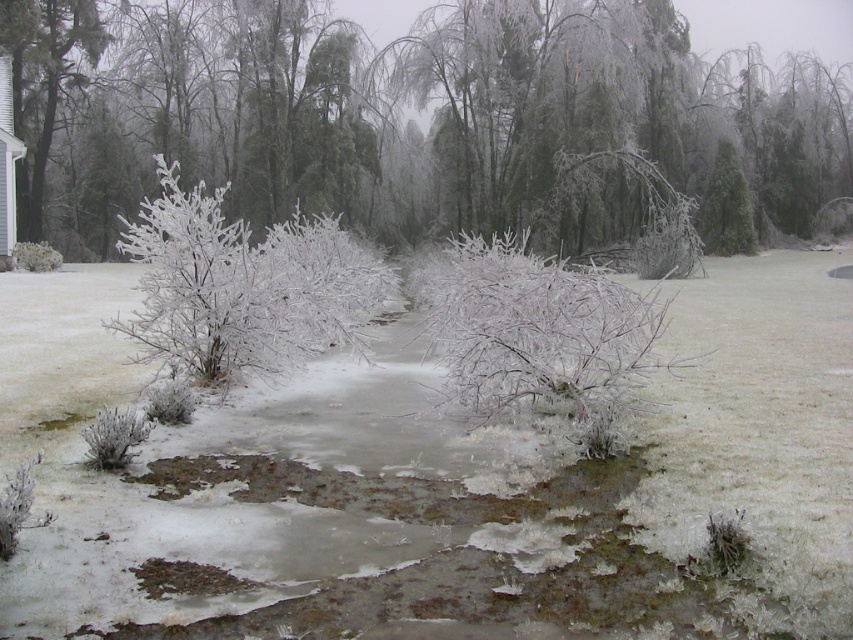
You are standing in the winter scene described. You notice a point marked at coordinates (410, 124). What object is located at this point?

The point at coordinates (410, 124) is where the frosted branches at center are located.

You are standing in the winter scene and want to walk from the frosted white bush at center to the white frosty bush at lower left. Which direction should you move relative to the bushes?

To move from the frosted white bush at center to the white frosty bush at lower left, you should move downward because the frosted white bush at center is positioned over the white frosty bush at lower left.

You are an artist trying to capture this winter scene. You need to decide which object to focus on first based on their sizes. Which one is wider, the frosted branches at center or the frosted white bush at upper right?

The frosted branches at center are wider than the frosted white bush at upper right.